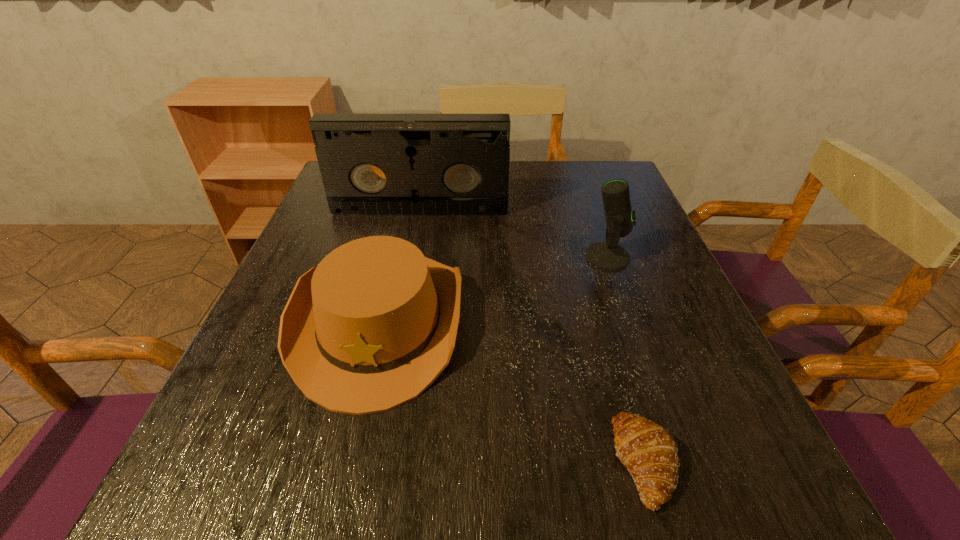
Locate which object is the third closest to the shortest object. Please provide its 2D coordinates. Your answer should be formatted as a tuple, i.e. [(x, y)], where the tuple contains the x and y coordinates of a point satisfying the conditions above.

[(371, 164)]

At what (x,y) coordinates should I click in order to perform the action: click on vacant space that satisfies the following two spatial constraints: 1. on the front side of the microphone; 2. on the right side of the tallest object. Please return your answer as a coordinate pair (x, y). Looking at the image, I should click on (412, 256).

Where is `vacant point that satisfies the following two spatial constraints: 1. on the front-facing side of the cowboy hat; 2. on the right side of the nearest object`? vacant point that satisfies the following two spatial constraints: 1. on the front-facing side of the cowboy hat; 2. on the right side of the nearest object is located at coordinates coord(347,462).

What are the coordinates of `vacant space that satisfies the following two spatial constraints: 1. on the front-facing side of the second shortest object; 2. on the left side of the nearest object` in the screenshot? It's located at (347, 462).

Identify the location of vacant region that satisfies the following two spatial constraints: 1. on the front side of the videotape; 2. on the right side of the microphone. This screenshot has width=960, height=540. (412, 256).

Where is `free space that satisfies the following two spatial constraints: 1. on the front side of the videotape; 2. on the right side of the nearest object`? The width and height of the screenshot is (960, 540). free space that satisfies the following two spatial constraints: 1. on the front side of the videotape; 2. on the right side of the nearest object is located at coordinates (372, 462).

Image resolution: width=960 pixels, height=540 pixels. Identify the location of vacant region that satisfies the following two spatial constraints: 1. on the front side of the shortest object; 2. on the left side of the farthest object. (372, 462).

This screenshot has width=960, height=540. I want to click on vacant region that satisfies the following two spatial constraints: 1. on the front-facing side of the crescent roll; 2. on the left side of the cowboy hat, so click(347, 462).